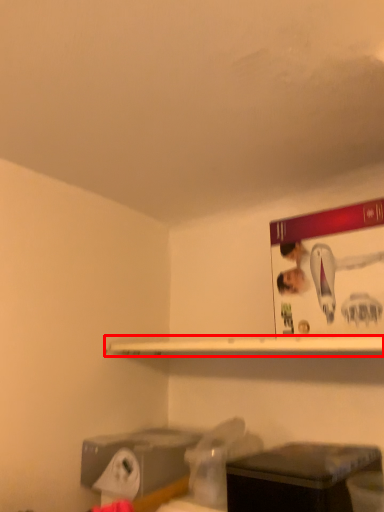
Question: From the image's perspective, where is shelf (annotated by the red box) located relative to furniture?

Choices:
 (A) above
 (B) below

Answer: (A)